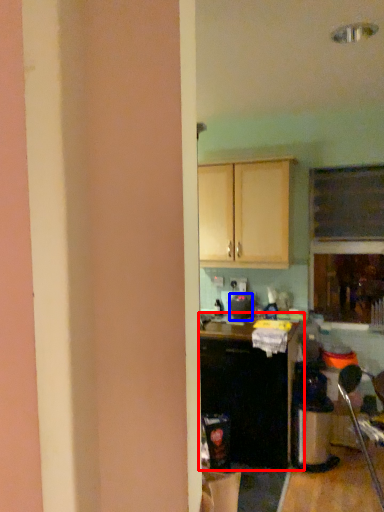
Question: Which object appears farthest to the camera in this image, cabinetry (highlighted by a red box) or appliance (highlighted by a blue box)?

Choices:
 (A) cabinetry
 (B) appliance

Answer: (B)